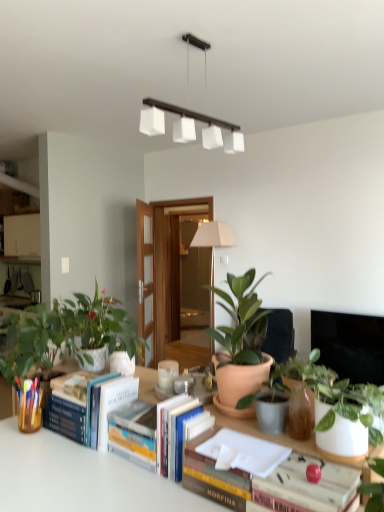
Question: Is hardcover book at center, positioned as the first book in back-to-front order, thinner than white matte table at lower center?

Choices:
 (A) no
 (B) yes

Answer: (B)

Question: Is hardcover book at center, arranged as the 1th book when viewed from the left, outside of white matte table at lower center?

Choices:
 (A) yes
 (B) no

Answer: (B)

Question: Can you confirm if hardcover book at center, positioned as the second book in right-to-left order, is positioned to the left of white matte table at lower center?

Choices:
 (A) no
 (B) yes

Answer: (A)

Question: Does hardcover book at center, the 2th book when ordered from front to back, have a larger size compared to white matte table at lower center?

Choices:
 (A) no
 (B) yes

Answer: (A)

Question: Are hardcover book at center, positioned as the first book in back-to-front order, and white matte table at lower center far apart?

Choices:
 (A) no
 (B) yes

Answer: (A)

Question: Can you see hardcover book at center, positioned as the second book in right-to-left order, touching white matte table at lower center?

Choices:
 (A) no
 (B) yes

Answer: (A)

Question: Is hardcover book at center, arranged as the 1th book when viewed from the right, with green matte plant at left, positioned as the 1th houseplant in left-to-right order?

Choices:
 (A) no
 (B) yes

Answer: (A)

Question: From the image's perspective, is hardcover book at center, the 1th book positioned from the front, beneath green matte plant at left, the fifth houseplant positioned from the right?

Choices:
 (A) yes
 (B) no

Answer: (A)

Question: Is hardcover book at center, which appears as the second book when viewed from the left, positioned with its back to green matte plant at left, positioned as the 1th houseplant in left-to-right order?

Choices:
 (A) no
 (B) yes

Answer: (A)

Question: Is hardcover book at center, which appears as the second book when viewed from the left, positioned behind green matte plant at left, positioned as the 1th houseplant in left-to-right order?

Choices:
 (A) yes
 (B) no

Answer: (B)

Question: From a real-world perspective, is hardcover book at center, which is counted as the 2th book, starting from the back, on top of green matte plant at left, the fifth houseplant positioned from the right?

Choices:
 (A) yes
 (B) no

Answer: (B)

Question: Is hardcover book at center, which appears as the second book when viewed from the left, at the left side of green matte plant at left, positioned as the 1th houseplant in left-to-right order?

Choices:
 (A) yes
 (B) no

Answer: (B)

Question: From the image's perspective, is white glossy pot at center, the second houseplant viewed from the left, over green matte plant at left, positioned as the 1th houseplant in left-to-right order?

Choices:
 (A) yes
 (B) no

Answer: (A)